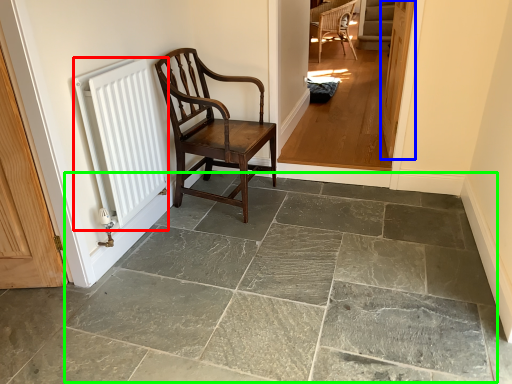
Question: Which object is the farthest from radiator (highlighted by a red box)? Choose among these: door (highlighted by a blue box) or limestone (highlighted by a green box).

Choices:
 (A) door
 (B) limestone

Answer: (A)